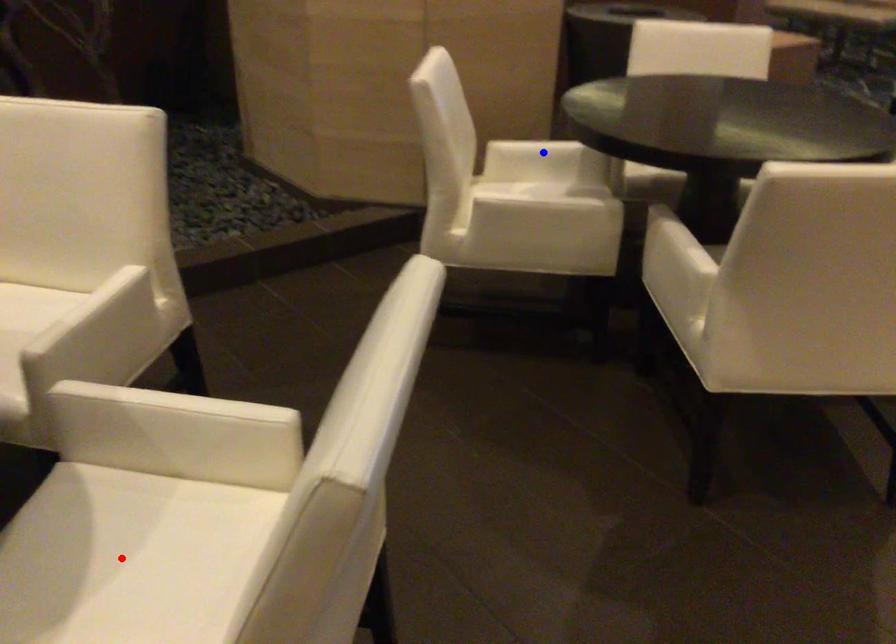
Question: Two points are marked on the image. Which point is closer to the camera?

Choices:
 (A) Blue point is closer.
 (B) Red point is closer.

Answer: (B)